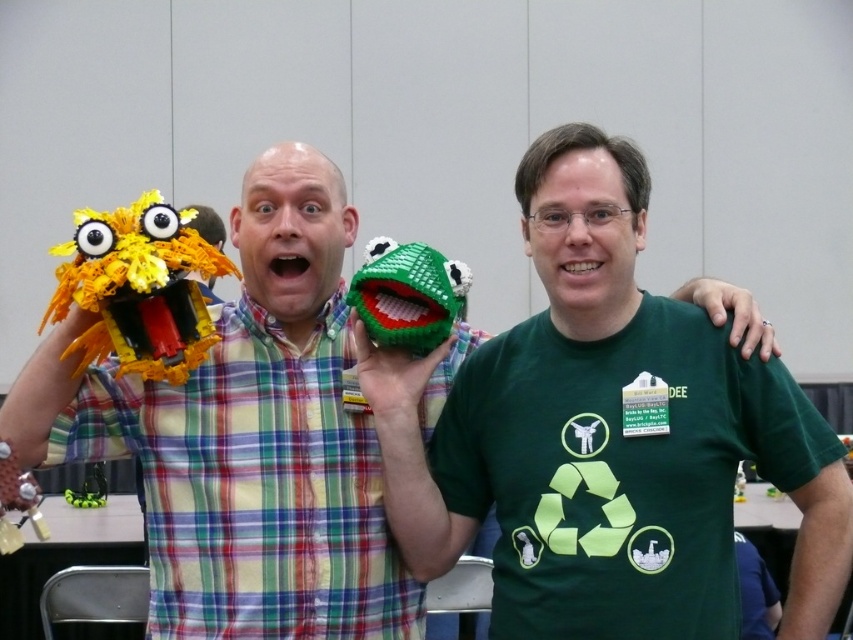
Question: Can you confirm if yellow plastic bird at left is positioned above bright green plastic frog at center?

Choices:
 (A) no
 (B) yes

Answer: (A)

Question: Which of the following is the closest to the observer?

Choices:
 (A) (85, 332)
 (B) (445, 308)

Answer: (A)

Question: Which object is the farthest from the plastic lego mask at upper center?

Choices:
 (A) bright green plastic frog at center
 (B) yellow plastic bird at left

Answer: (A)

Question: Estimate the real-world distances between objects in this image. Which object is farther from the yellow plastic bird at left?

Choices:
 (A) green matte/soft toy at center
 (B) plastic lego mask at upper center
 (C) bright green plastic frog at center

Answer: (A)

Question: Considering the relative positions of green matte/soft toy at center and bright green plastic frog at center in the image provided, where is green matte/soft toy at center located with respect to bright green plastic frog at center?

Choices:
 (A) below
 (B) above

Answer: (A)

Question: Can you confirm if yellow plastic bird at left is positioned to the right of bright green plastic frog at center?

Choices:
 (A) no
 (B) yes

Answer: (A)